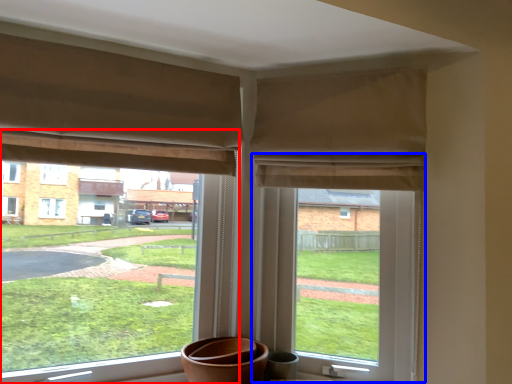
Question: Which point is further to the camera, window (highlighted by a red box) or window screen (highlighted by a blue box)?

Choices:
 (A) window
 (B) window screen

Answer: (B)